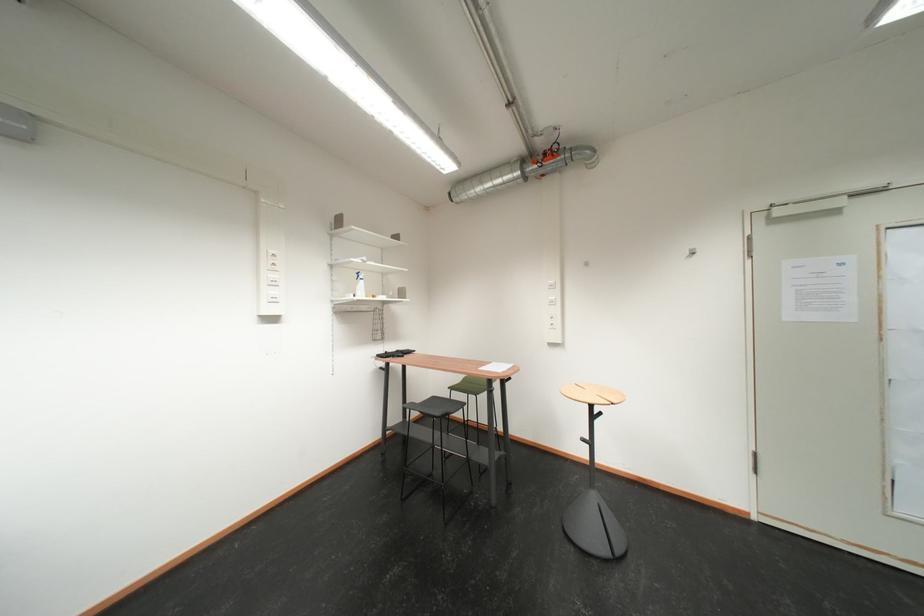
Where is `light switch`? This screenshot has width=924, height=616. light switch is located at coordinates (553, 330).